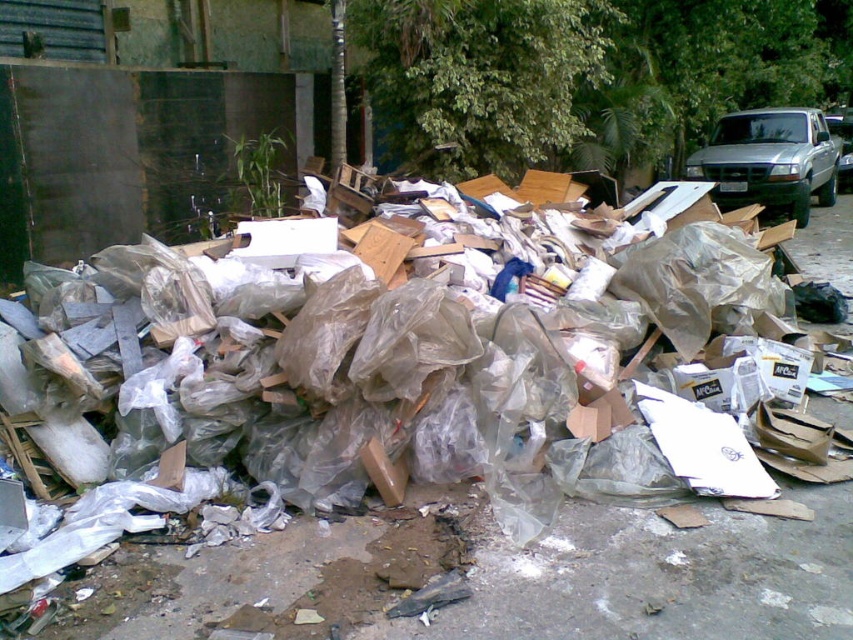
You are a waste management inspector tasked with identifying specific items in a waste pile. You are given coordinates pointing to an item in the pile. Which item is located at point (236,582)?

The point (236,582) corresponds to translucent plastic debris at center.

You are a waste management inspector standing at the edge of the debris pile. You notice two points marked in the scene. Which point, point (639, 531) or point (798, 216), is closer to your current position?

Point (639, 531) is closer to the viewer than point (798, 216), so the closer point is point (639, 531).

You are a waste management worker assessing the scene. You see the translucent plastic debris at center and the silver metallic truck at upper right. Which object is bigger in size?

The translucent plastic debris at center has a larger size compared to the silver metallic truck at upper right.